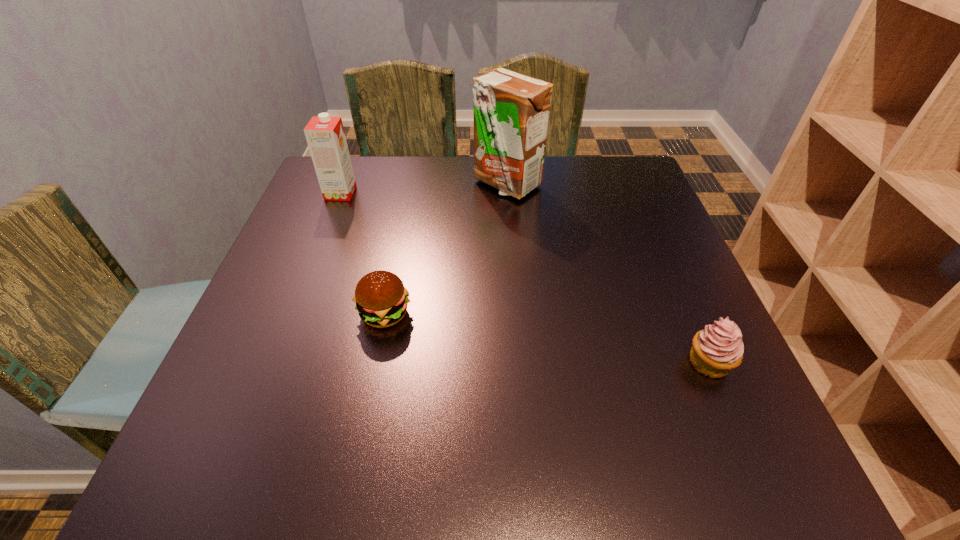
Identify the location of the third object from left to right. Image resolution: width=960 pixels, height=540 pixels. (511, 111).

The image size is (960, 540). What are the coordinates of `the taller carton` in the screenshot? It's located at (511, 111).

Find the location of `the leftmost object`. the leftmost object is located at coordinates (325, 135).

Locate an element on the screen. the second tallest object is located at coordinates (325, 135).

This screenshot has width=960, height=540. What are the coordinates of `the nearest object` in the screenshot? It's located at (718, 349).

Locate an element on the screen. the rightmost object is located at coordinates (718, 349).

Locate an element on the screen. The image size is (960, 540). hamburger is located at coordinates (381, 299).

The image size is (960, 540). Identify the location of the third object from right to left. (381, 299).

Where is `free space located on the straw side of the taller carton`? The height and width of the screenshot is (540, 960). free space located on the straw side of the taller carton is located at coordinates (516, 306).

This screenshot has width=960, height=540. Find the location of `vacant area situated 0.100m on the right of the shorter carton`. vacant area situated 0.100m on the right of the shorter carton is located at coordinates (392, 193).